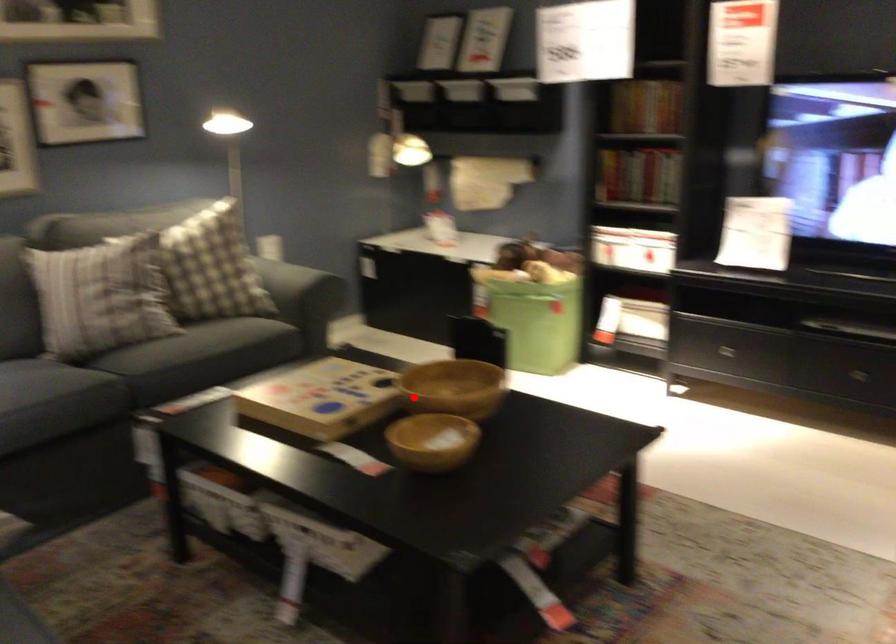
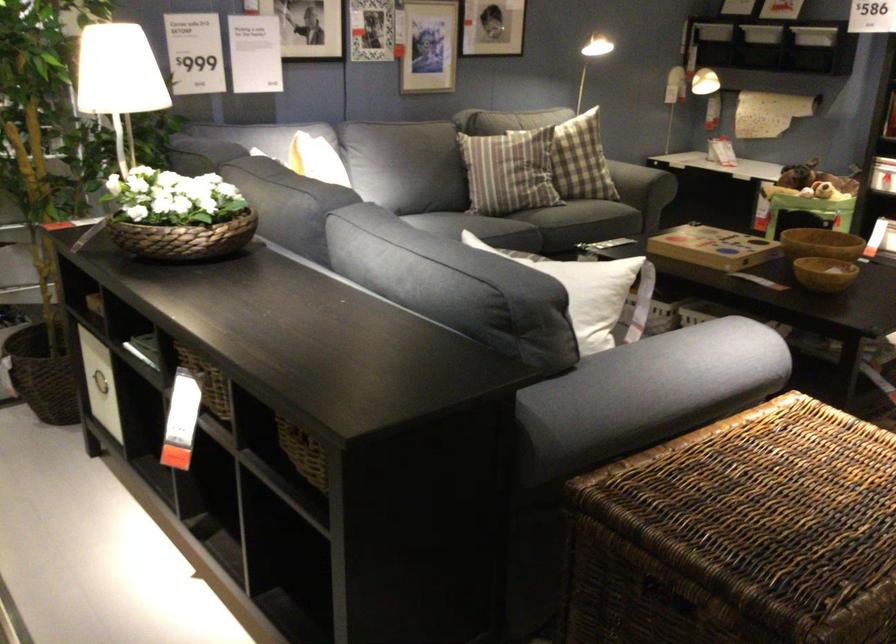
Question: I am providing you with two images of the same scene from different viewpoints. A red point is shown in image1. For the corresponding object point in image2, is it positioned nearer or farther from the camera?

Choices:
 (A) Nearer
 (B) Farther

Answer: (B)